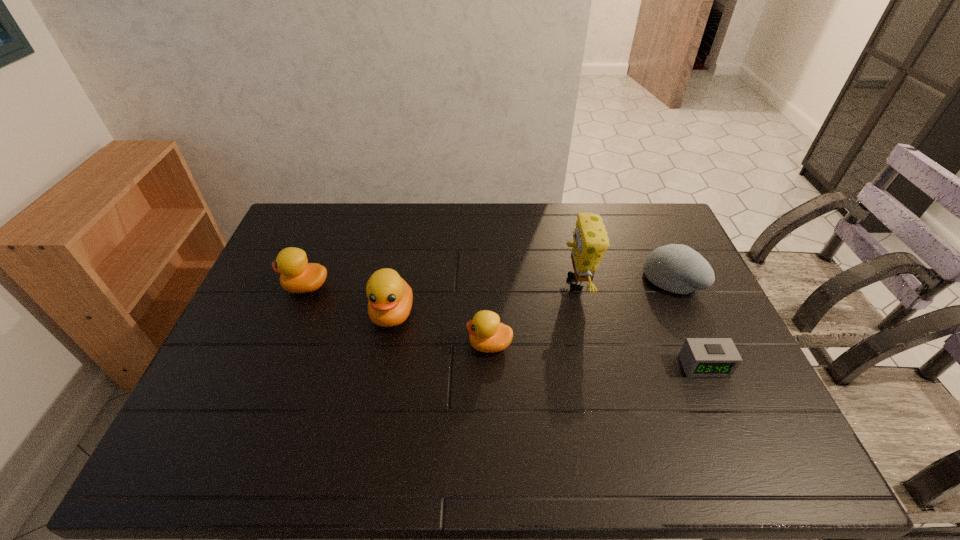
I want to click on beanie present at the right edge, so click(x=677, y=268).

Where is `vacant region at the far edge of the desktop`? Image resolution: width=960 pixels, height=540 pixels. vacant region at the far edge of the desktop is located at coordinates (622, 214).

In the image, there is a desktop. Where is `vacant space at the near edge`? vacant space at the near edge is located at coordinates (314, 405).

In the image, there is a desktop. Where is `vacant space at the left edge`? vacant space at the left edge is located at coordinates (256, 321).

In the image, there is a desktop. Where is `free region at the near left corner`? free region at the near left corner is located at coordinates (232, 420).

Image resolution: width=960 pixels, height=540 pixels. Identify the location of vacant space at the near right corner of the desktop. (741, 401).

In order to click on free space between the leftmost duckling and the fifth object from right to left in this screenshot , I will do `click(349, 300)`.

The width and height of the screenshot is (960, 540). I want to click on free area in between the alarm clock and the beanie, so click(687, 322).

You are a GUI agent. You are given a task and a screenshot of the screen. Output one action in this format:
    pyautogui.click(x=<x>, y=<y>)
    Task: Click on the free space between the sponge and the second duckling from right to left
    The height and width of the screenshot is (540, 960).
    Given the screenshot: What is the action you would take?
    pyautogui.click(x=484, y=298)

Identify the location of vacant space that's between the third object from left to right and the beanie. (581, 312).